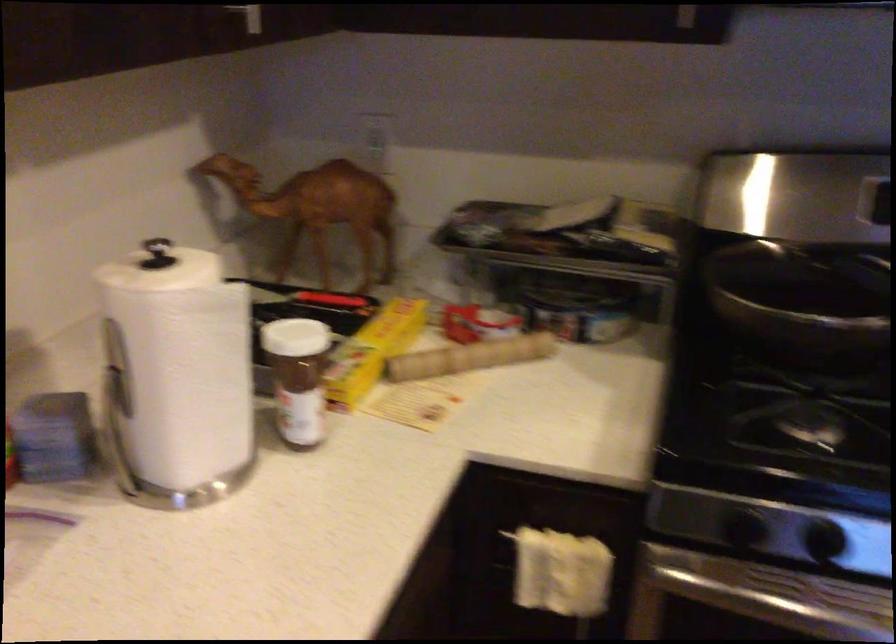
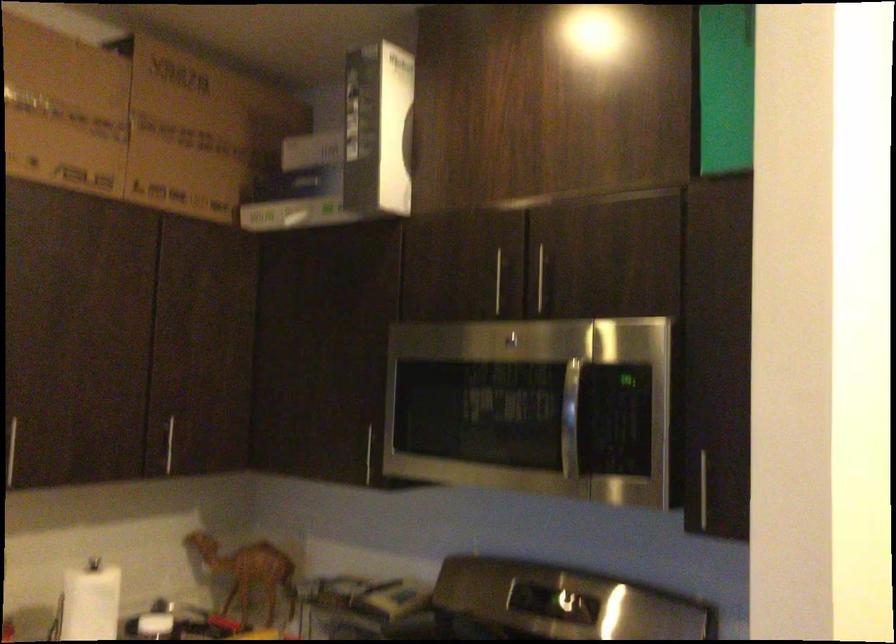
Find the pixel in the second image that matches [205,341] in the first image.

(90, 601)